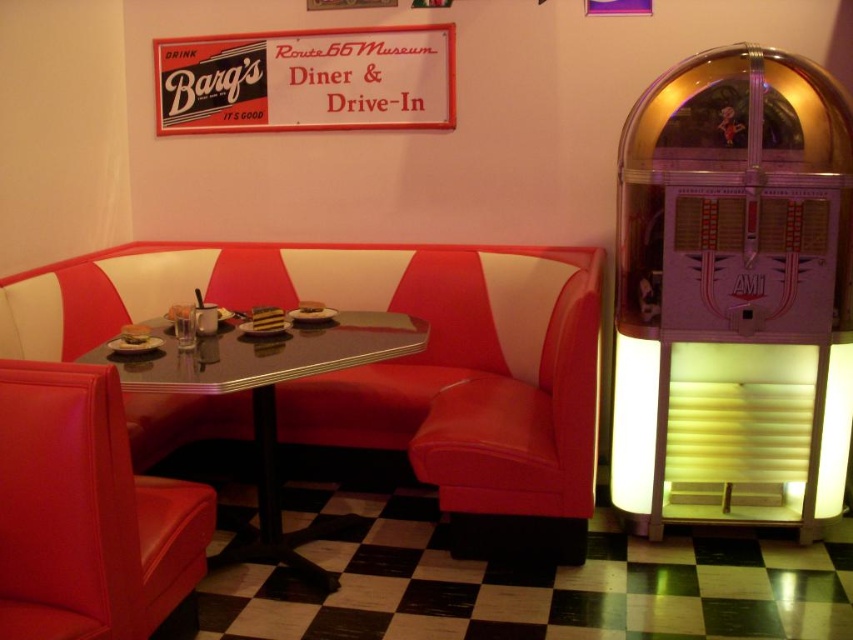
Question: Which object is closer to the camera taking this photo?

Choices:
 (A) white cardboard sign at upper center
 (B) matte red leather armchair at center
 (C) matte red armchair at lower left
 (D) shiny black table at center

Answer: (C)

Question: Which of the following is the farthest from the observer?

Choices:
 (A) white cardboard sign at upper center
 (B) matte red armchair at lower left
 (C) shiny black table at center
 (D) matte red leather armchair at center

Answer: (A)

Question: Does white cardboard sign at upper center lie behind shiny black table at center?

Choices:
 (A) yes
 (B) no

Answer: (A)

Question: Can you confirm if matte red armchair at lower left is positioned below matte red leather armchair at center?

Choices:
 (A) yes
 (B) no

Answer: (A)

Question: Can you confirm if matte red leather armchair at center is positioned below white cardboard sign at upper center?

Choices:
 (A) yes
 (B) no

Answer: (A)

Question: Which of the following is the closest to the observer?

Choices:
 (A) (244, 547)
 (B) (155, 513)

Answer: (B)